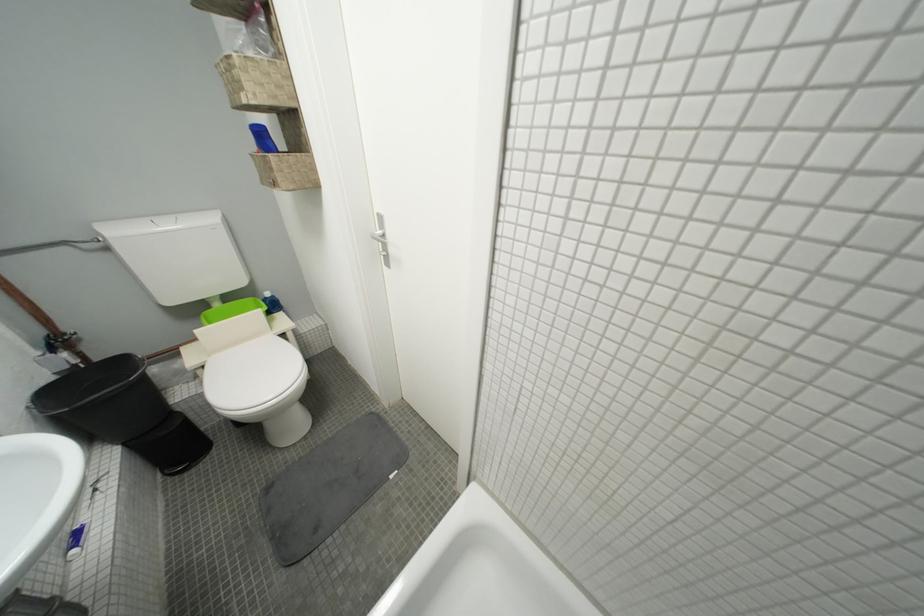
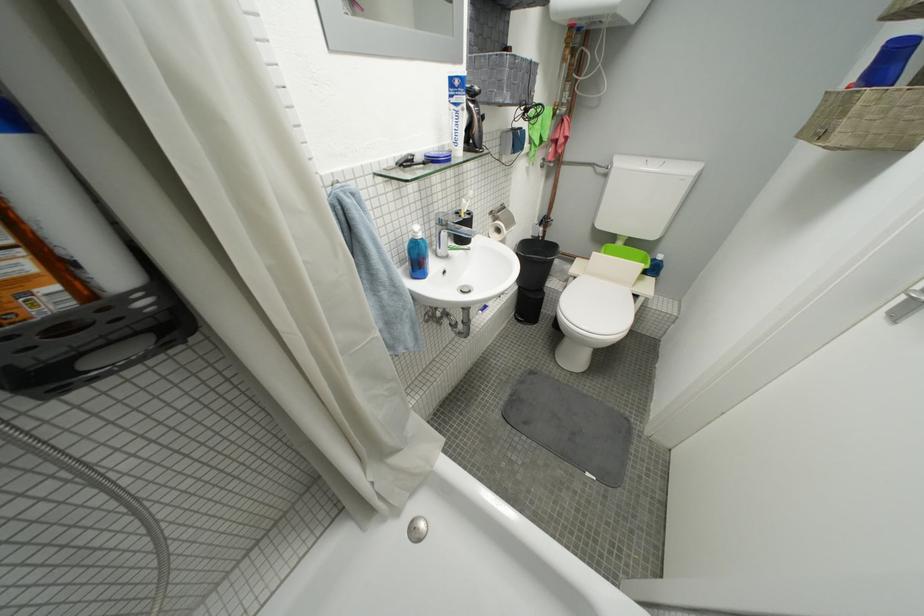
The point at (213, 370) is marked in the first image. Where is the corresponding point in the second image?

(584, 281)